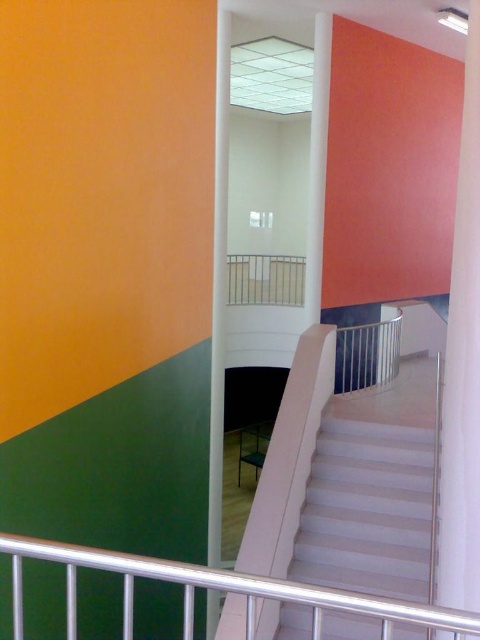
Question: Considering the real-world distances, which object is closest to the white glossy stairs at center?

Choices:
 (A) metallic silver balustrade at center
 (B) silver metallic railing at lower center

Answer: (B)

Question: Can you confirm if white glossy stairs at center is positioned above metallic silver balustrade at center?

Choices:
 (A) no
 (B) yes

Answer: (A)

Question: Is white glossy stairs at center in front of white glossy column at center?

Choices:
 (A) yes
 (B) no

Answer: (A)

Question: In this image, where is white glossy stairs at center located relative to metallic silver balustrade at center?

Choices:
 (A) left
 (B) right

Answer: (B)

Question: Which object is farther from the camera taking this photo?

Choices:
 (A) metallic silver balustrade at center
 (B) white glossy column at center
 (C) silver metallic railing at lower center
 (D) white glossy pillar at center

Answer: (A)

Question: Which object is positioned closest to the silver metallic railing at lower center?

Choices:
 (A) metallic silver balustrade at center
 (B) white glossy column at center
 (C) white glossy stairs at center
 (D) white glossy pillar at center

Answer: (D)